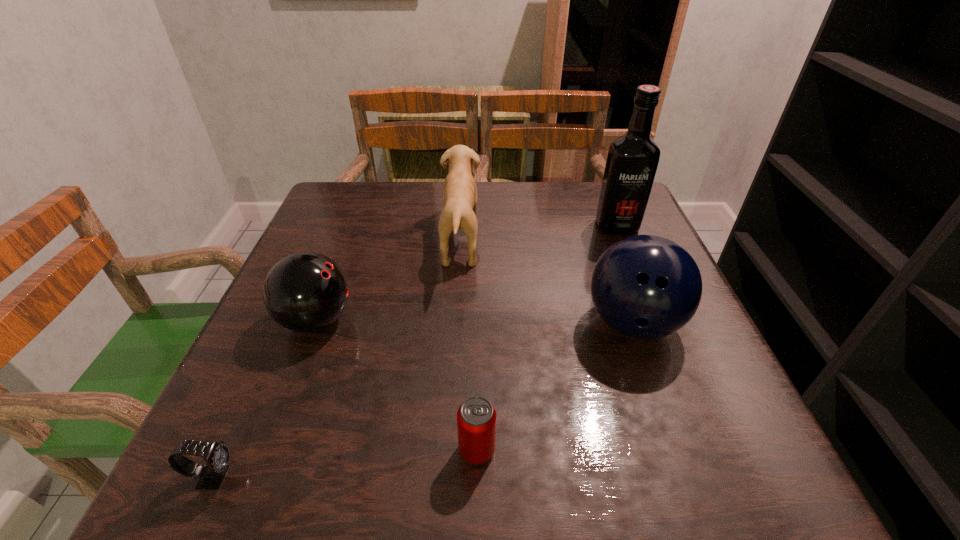
The width and height of the screenshot is (960, 540). Identify the location of liquor. (632, 160).

Identify the location of the right bowling ball. (646, 287).

Locate an element on the screen. puppy is located at coordinates (459, 192).

In order to click on the left bowling ball in this screenshot , I will do `click(304, 292)`.

Find the location of a particular element. This screenshot has height=540, width=960. the shorter bowling ball is located at coordinates (304, 292).

Where is `can`? The image size is (960, 540). can is located at coordinates (476, 418).

Image resolution: width=960 pixels, height=540 pixels. What are the coordinates of `the shortest object` in the screenshot? It's located at (217, 456).

Locate an element on the screen. vacant space located on the front-facing side of the tallest object is located at coordinates 631,258.

I want to click on vacant position located on the surface of the taller bowling ball near the finger holes, so click(660, 401).

What are the coordinates of `vacant region located on the left side of the puppy` in the screenshot? It's located at (547, 241).